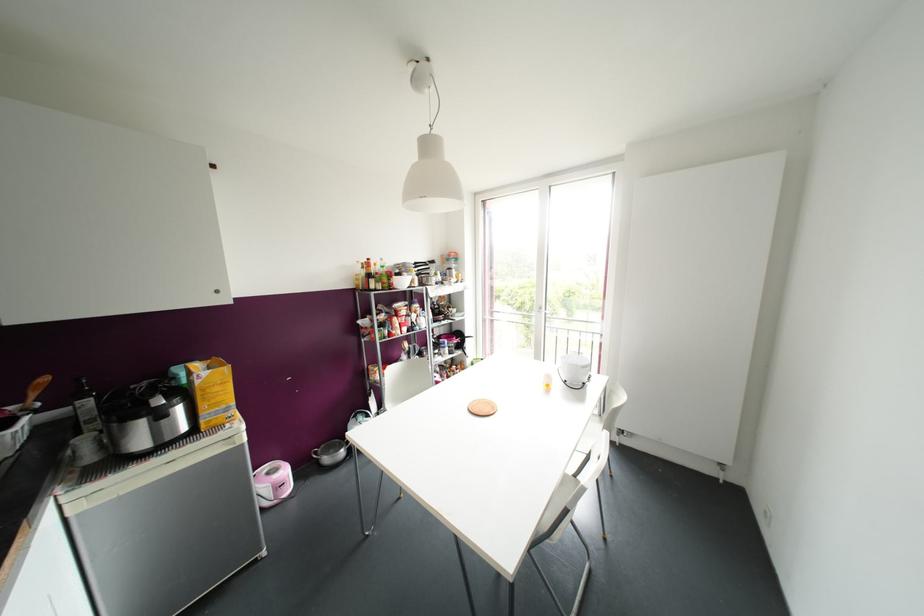
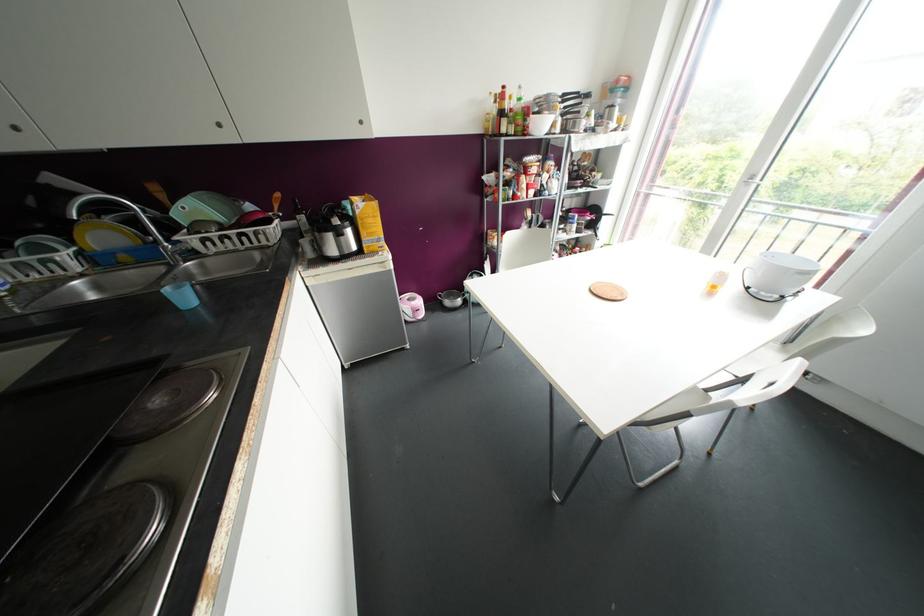
Locate, in the second image, the point that corresponds to point (540, 308) in the first image.

(752, 177)